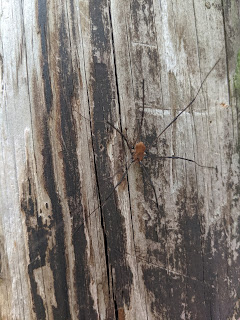
This screenshot has width=240, height=320. I want to click on dark spots on wood, so click(x=202, y=278), click(x=110, y=207), click(x=76, y=183), click(x=55, y=201), click(x=36, y=238).